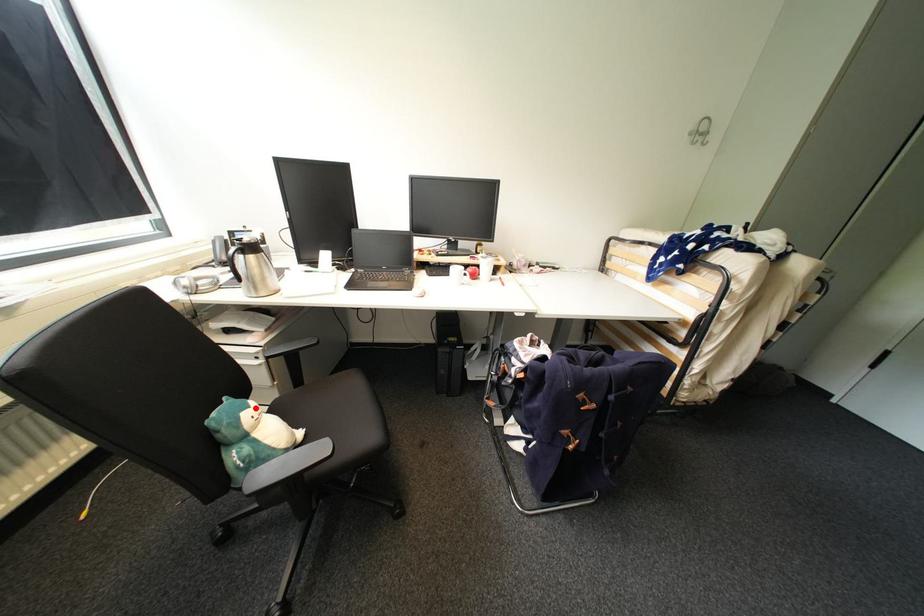
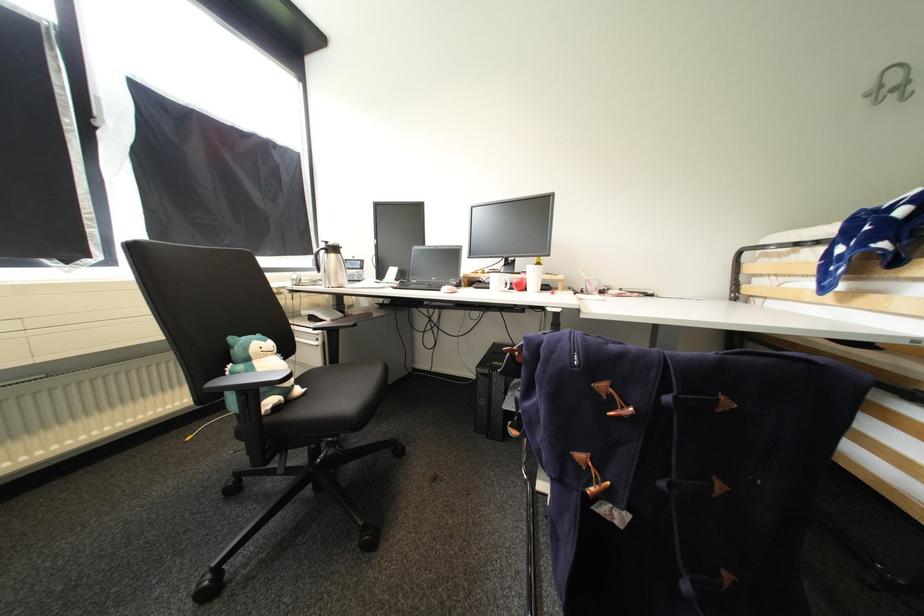
Question: I am providing you with two images of the same scene from different viewpoints. Given a red point in image1, look at the same physical point in image2. Is it:

Choices:
 (A) Closer to the viewpoint
 (B) Farther from the viewpoint

Answer: (B)